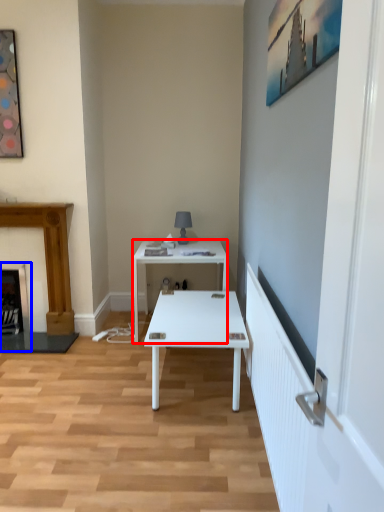
Question: Which point is further to the camera, desk (highlighted by a red box) or fireplace (highlighted by a blue box)?

Choices:
 (A) desk
 (B) fireplace

Answer: (B)